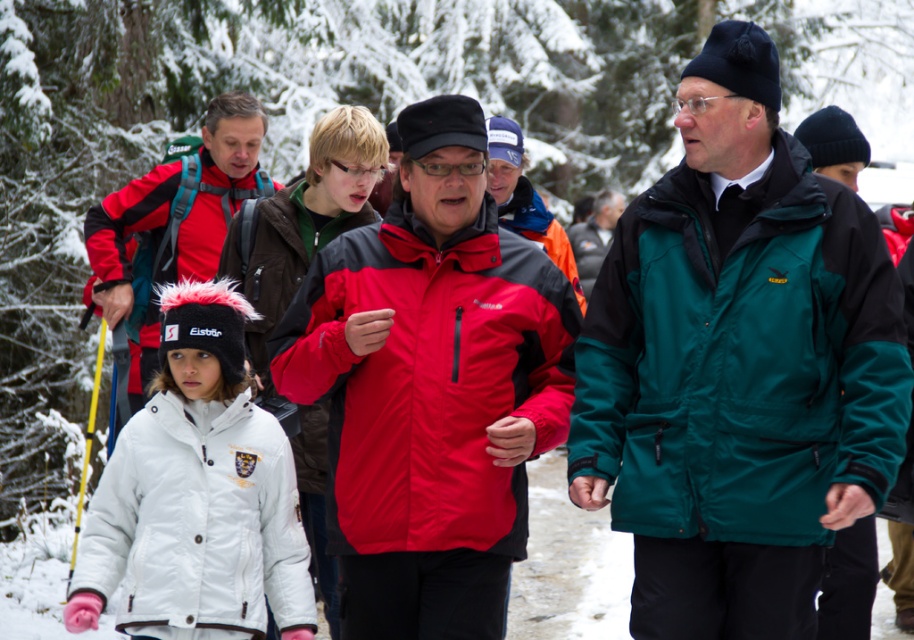
Question: Which of these objects is positioned farthest from the white puffy jacket at lower left?

Choices:
 (A) yellow plastic ski pole at left
 (B) white fleece jacket at center

Answer: (A)

Question: In this image, where is white puffy jacket at lower left located relative to matte red jacket at center?

Choices:
 (A) below
 (B) above

Answer: (A)

Question: Does red matte jacket at center come in front of white puffy jacket at lower left?

Choices:
 (A) yes
 (B) no

Answer: (A)

Question: Does red matte jacket at center have a greater width compared to yellow plastic ski pole at left?

Choices:
 (A) no
 (B) yes

Answer: (B)

Question: Which object appears closest to the camera in this image?

Choices:
 (A) white fleece jacket at center
 (B) white puffy jacket at lower left
 (C) red matte jacket at center
 (D) matte red jacket at center

Answer: (C)

Question: Which point is closer to the camera?

Choices:
 (A) white puffy jacket at lower left
 (B) white fleece jacket at center
 (C) green matte jacket at center
 (D) matte red jacket at center

Answer: (C)